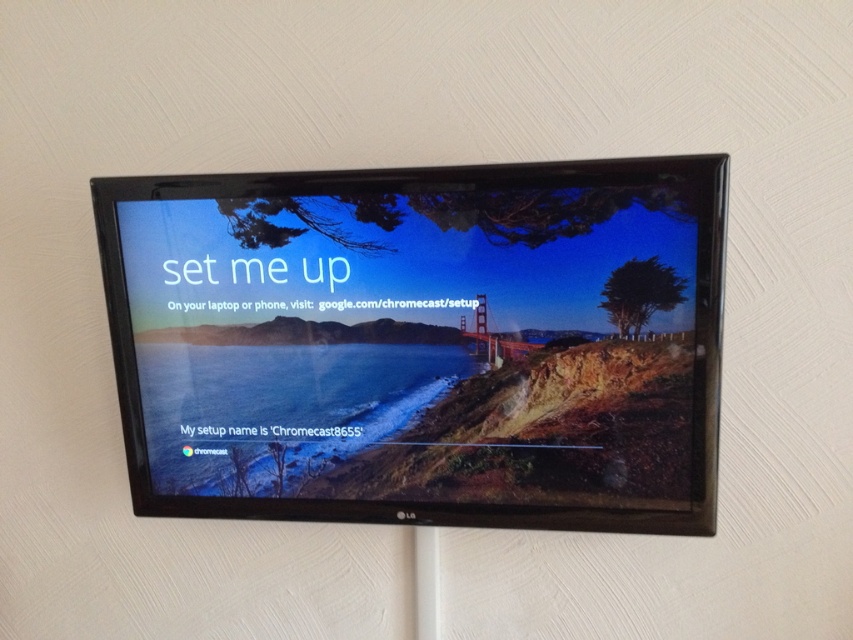
You are setting up a Google Chromecast and need to connect your device to the TV. You notice both the matte black tv at center and the metallic bridge at center in the image. Which object is positioned closer to you?

The matte black tv at center is closer to the viewer than the metallic bridge at center.

You are standing in a living room and want to watch a movie on the matte black tv at center. According to the recommended viewing distance for optimal comfort, which is 1.5 times the screen diagonal, can you comfortably watch the movie from your current position?

The distance between you and the matte black tv at center is 3.29 feet. To determine comfort, calculate 1.5 times the TV diagonal. However, the TV size isnecessary to compute this. Without knowing the TV size, we can only confirm the current distance is 3.29 feet.